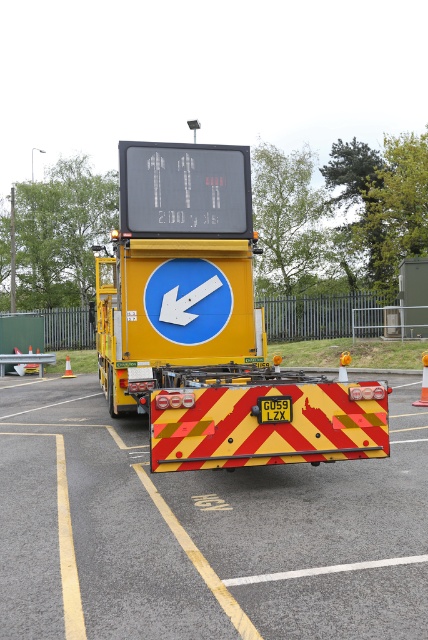
Question: In this image, where is orange reflective cone at lower right located relative to orange plastic traffic cone at lower left?

Choices:
 (A) above
 (B) below

Answer: (A)

Question: Which point is farther from the camera taking this photo?

Choices:
 (A) tap(338, 502)
 (B) tap(26, 365)
 (C) tap(379, 444)
 (D) tap(68, 368)

Answer: (B)

Question: Is yellow reflective plastic at center below orange plastic traffic cone at lower left?

Choices:
 (A) yes
 (B) no

Answer: (B)

Question: Does yellow reflective plastic at center have a greater width compared to orange reflective cone at lower right?

Choices:
 (A) yes
 (B) no

Answer: (A)

Question: Which of the following is the farthest from the observer?

Choices:
 (A) [x=422, y=355]
 (B) [x=228, y=234]
 (C) [x=262, y=483]
 (D) [x=15, y=365]

Answer: (D)

Question: Based on their relative distances, which object is farther from the yellow reflective plastic trailer at center?

Choices:
 (A) orange plastic traffic cone at left
 (B) orange plastic traffic cone at lower left
 (C) orange reflective cone at lower right
 (D) orange plastic traffic cone at lower right

Answer: (C)